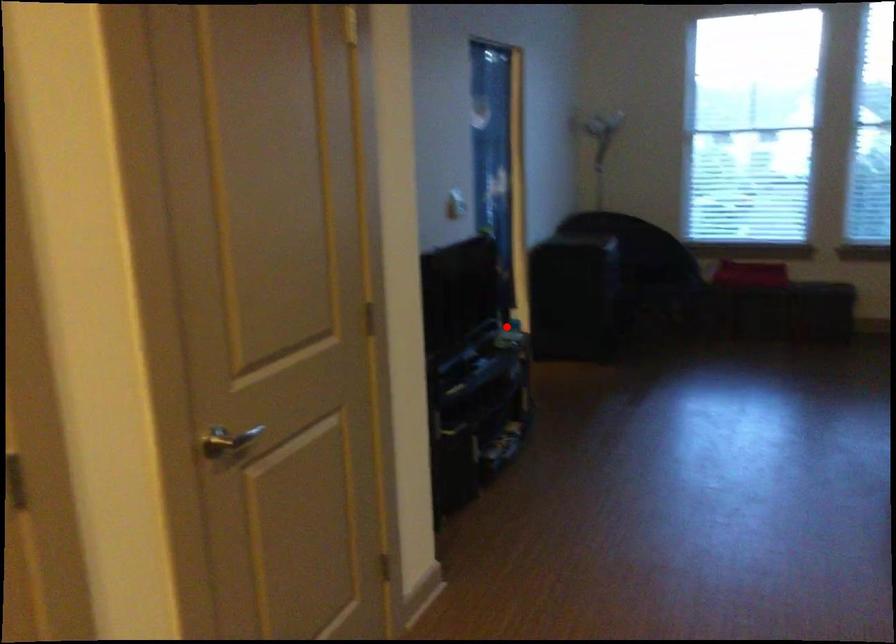
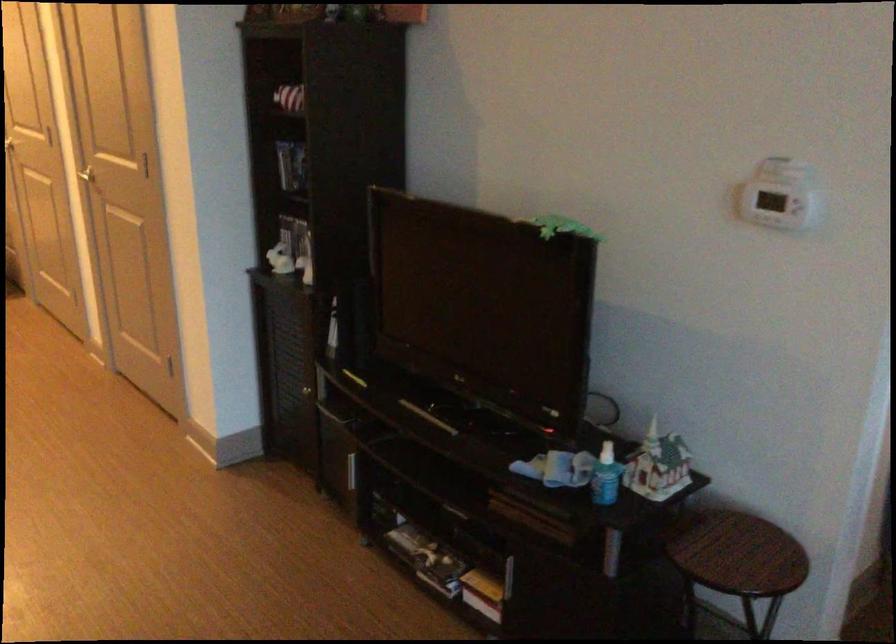
Find the pixel in the second image that matches the highlighted location in the first image.

(733, 547)